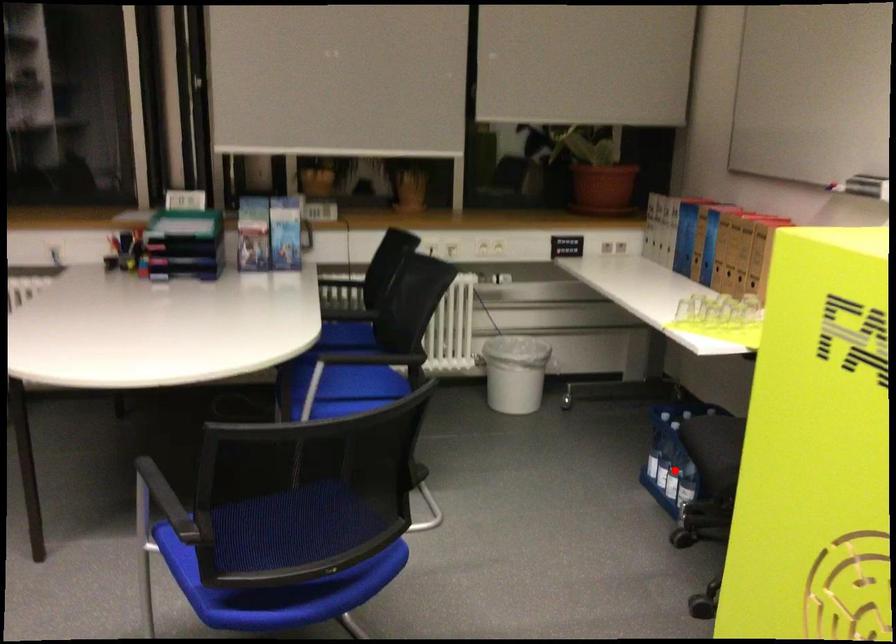
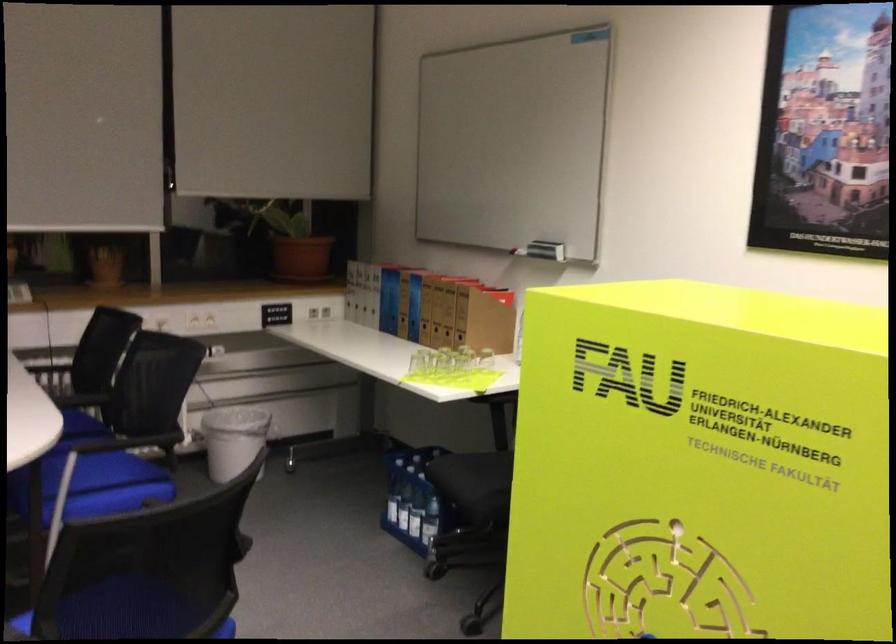
In the second image, find the point that corresponds to the highlighted location in the first image.

(416, 514)